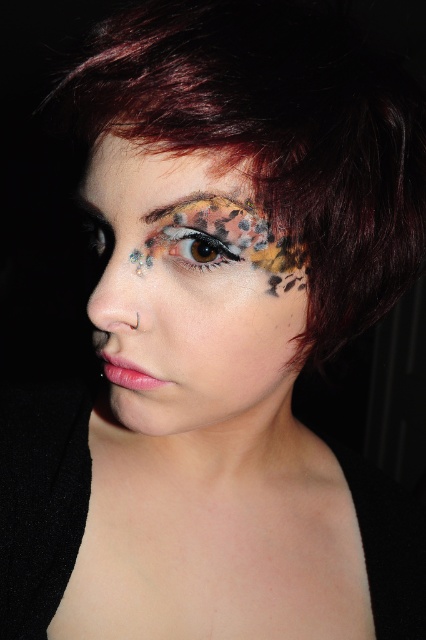
Question: Which object is the closest to the multicolored textured eyebrow at upper center?

Choices:
 (A) black matte eye at center
 (B) multicolored textured makeup at center
 (C) multicolored glitter eye at center

Answer: (C)

Question: Which point is closer to the camera?

Choices:
 (A) black matte eye at center
 (B) multicolored glitter eye at center

Answer: (B)

Question: Does multicolored glitter eye at center have a larger size compared to black matte eye at center?

Choices:
 (A) no
 (B) yes

Answer: (A)

Question: Where is multicolored textured makeup at center located in relation to multicolored textured eyebrow at upper center in the image?

Choices:
 (A) below
 (B) above

Answer: (A)

Question: Estimate the real-world distances between objects in this image. Which object is farther from the multicolored textured eyebrow at upper center?

Choices:
 (A) multicolored textured makeup at center
 (B) black matte eye at center

Answer: (B)

Question: Is multicolored textured makeup at center smaller than multicolored glitter eye at center?

Choices:
 (A) yes
 (B) no

Answer: (B)